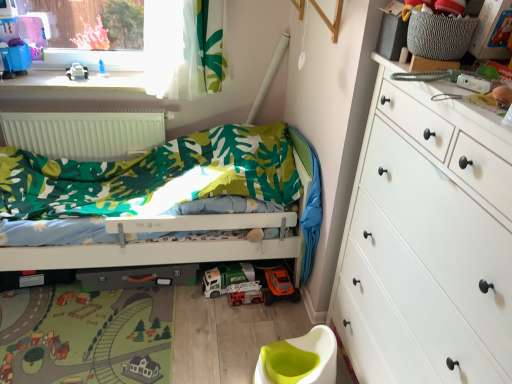
Where is `unoccupied area in front of white plastic toy car at upper left`? This screenshot has height=384, width=512. unoccupied area in front of white plastic toy car at upper left is located at coordinates (61, 84).